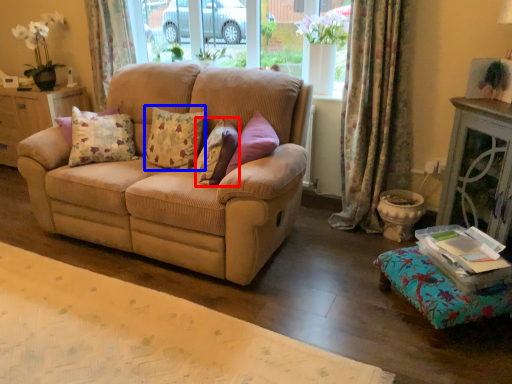
Question: Among these objects, which one is nearest to the camera, pillow (highlighted by a red box) or pillow (highlighted by a blue box)?

Choices:
 (A) pillow
 (B) pillow

Answer: (A)